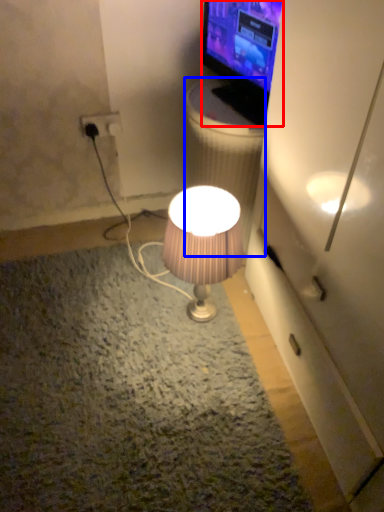
Question: Which object is further to the camera taking this photo, television (highlighted by a red box) or trash bin/can (highlighted by a blue box)?

Choices:
 (A) television
 (B) trash bin/can

Answer: (B)